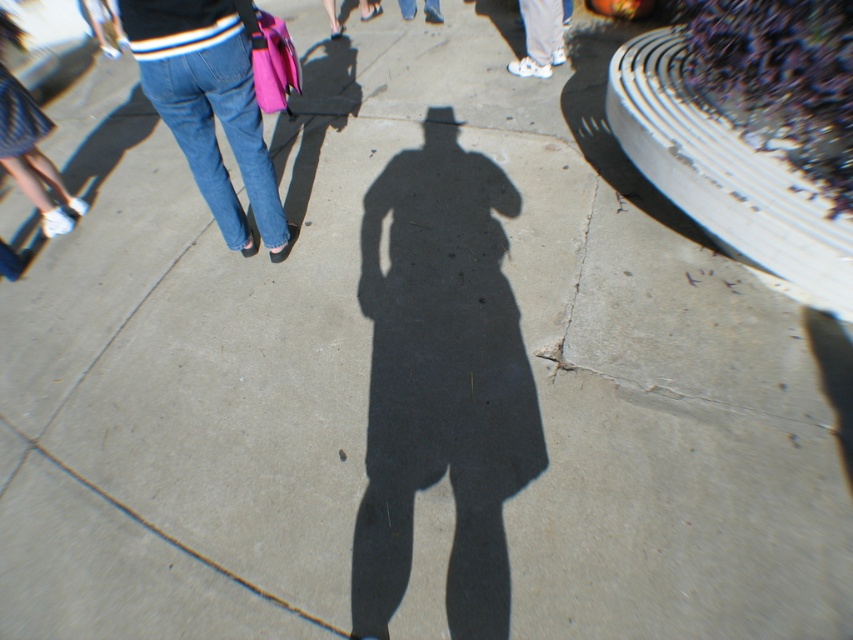
Question: Does denim jeans at center have a greater width compared to white matte sneakers at upper right?

Choices:
 (A) yes
 (B) no

Answer: (A)

Question: Can you confirm if denim jeans at center is positioned to the right of blue denim jeans at center?

Choices:
 (A) yes
 (B) no

Answer: (B)

Question: Is white matte sneakers at upper right smaller than blue denim jeans at center?

Choices:
 (A) no
 (B) yes

Answer: (A)

Question: Which of these objects is positioned closest to the white matte sneakers at upper right?

Choices:
 (A) denim jeans at center
 (B) blue denim jeans at center

Answer: (B)

Question: Which object is the farthest from the blue denim jeans at center?

Choices:
 (A) white matte sneakers at upper right
 (B) denim jeans at center

Answer: (B)

Question: Which object appears closest to the camera in this image?

Choices:
 (A) white matte sneakers at upper right
 (B) blue denim jeans at center

Answer: (A)